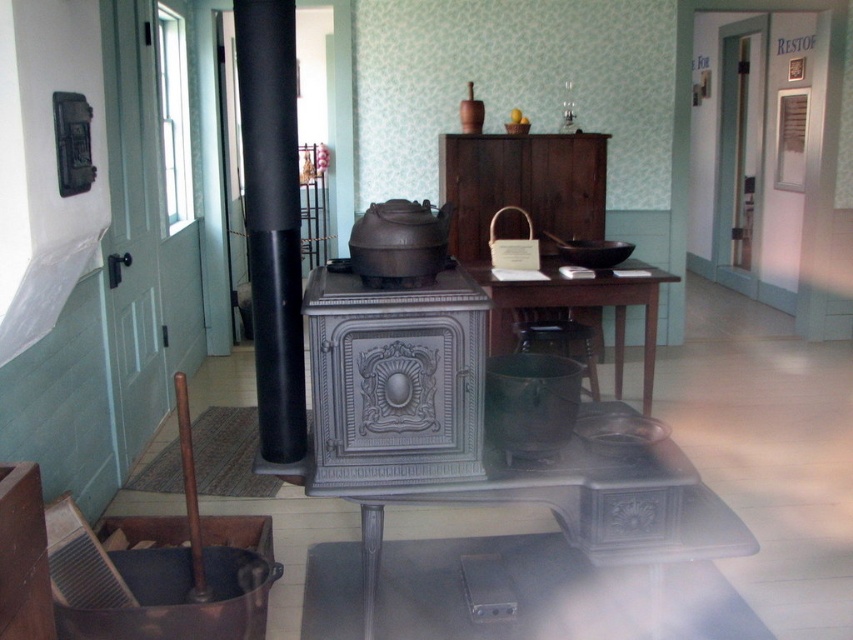
Is point (448, 433) less distant than point (567, 324)?

Yes, it is in front of point (567, 324).

The width and height of the screenshot is (853, 640). Describe the element at coordinates (395, 381) in the screenshot. I see `metallic gray stove at center` at that location.

What are the coordinates of `metallic gray stove at center` in the screenshot? It's located at (395, 381).

Who is more forward, [648,337] or [527,340]?

Positioned in front is point [648,337].

Which is above, dark wood table at center or wooden stool at center?

Positioned higher is dark wood table at center.

Identify the location of dark wood table at center. The width and height of the screenshot is (853, 640). (578, 307).

Is metallic gray stove at center positioned before dark wood table at center?

Yes, it is in front of dark wood table at center.

At what (x,y) coordinates should I click in order to perform the action: click on metallic gray stove at center. Please return your answer as a coordinate pair (x, y). Looking at the image, I should click on (395, 381).

Is point (318, 355) positioned behind point (529, 288)?

No, it is in front of (529, 288).

The height and width of the screenshot is (640, 853). Identify the location of metallic gray stove at center. (395, 381).